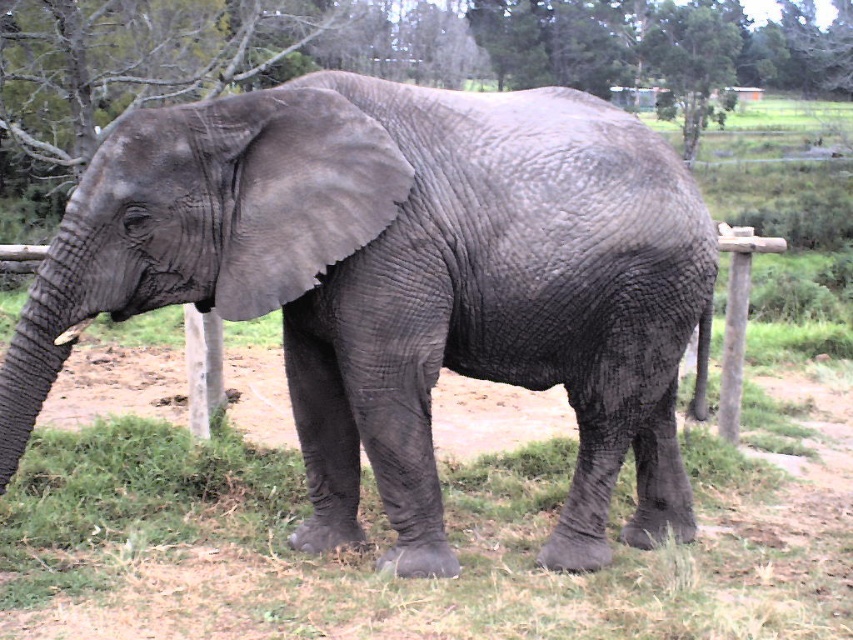
Question: Which of the following is the closest to the observer?

Choices:
 (A) gray rough elephant at center
 (B) green leafy tree at upper center

Answer: (A)

Question: Does gray rough elephant at center have a greater width compared to green leafy tree at upper center?

Choices:
 (A) yes
 (B) no

Answer: (A)

Question: Can you confirm if gray rough elephant at center is bigger than green leafy tree at upper center?

Choices:
 (A) yes
 (B) no

Answer: (A)

Question: Is gray rough elephant at center above green leafy tree at upper center?

Choices:
 (A) no
 (B) yes

Answer: (A)

Question: Which object is farther from the camera taking this photo?

Choices:
 (A) gray rough elephant at center
 (B) green leafy tree at upper center

Answer: (B)